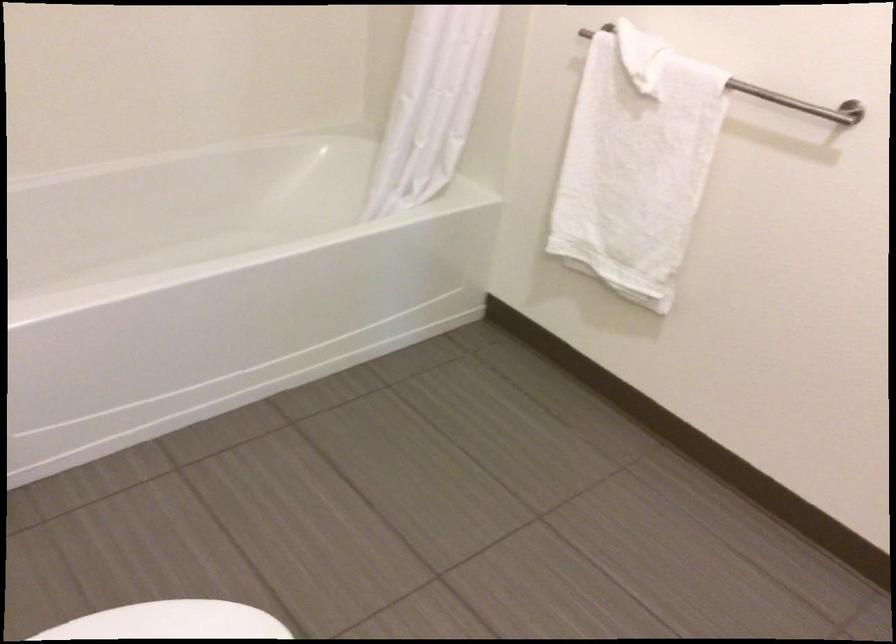
Which object does [634,164] point to?

This point indicates the white towel.